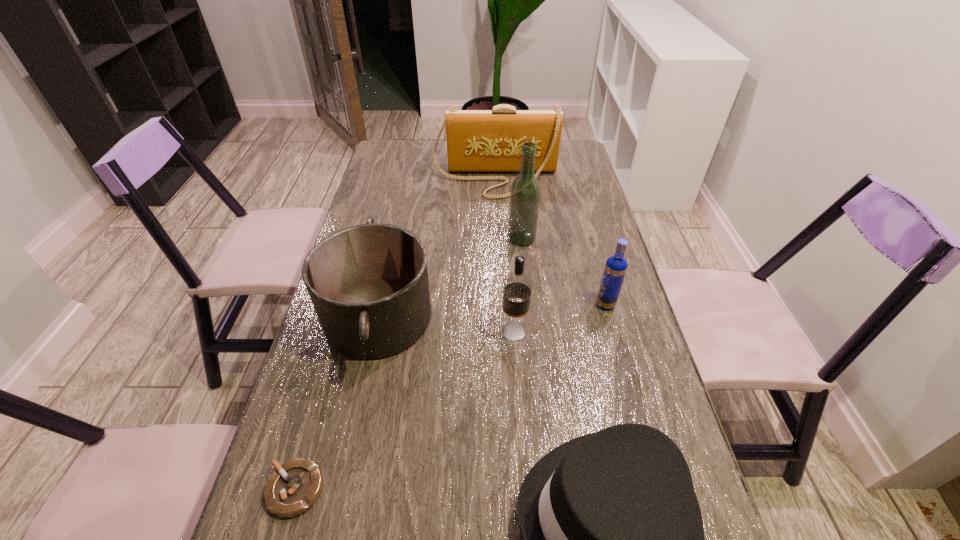
The image size is (960, 540). In order to click on the tallest object in this screenshot , I will do click(525, 192).

Identify the location of liquor. (525, 192).

Locate an element on the screen. The width and height of the screenshot is (960, 540). handbag is located at coordinates (x=477, y=140).

Identify the location of the nearer vodka. This screenshot has width=960, height=540. (517, 286).

Find the location of a particular element. This screenshot has height=540, width=960. the right vodka is located at coordinates (615, 269).

The height and width of the screenshot is (540, 960). What are the coordinates of `pan` in the screenshot? It's located at (369, 286).

Locate an element on the screen. ashtray is located at coordinates (293, 488).

The height and width of the screenshot is (540, 960). I want to click on free spot located 0.210m on the back of the tallest object, so click(516, 193).

I want to click on free region located on the decorative side of the handbag, so click(x=498, y=243).

Identify the location of blank space located on the label of the nearer vodka. (446, 330).